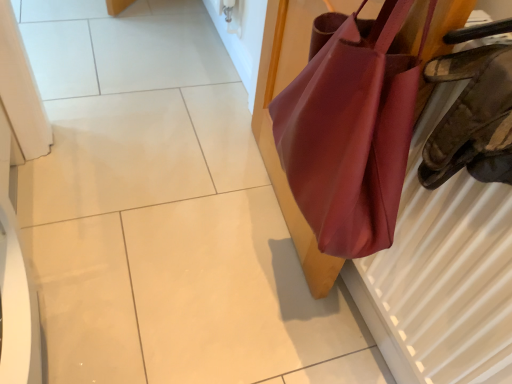
Locate an element on the screen. This screenshot has width=512, height=384. free space in front of matte leather handbag at right is located at coordinates (233, 295).